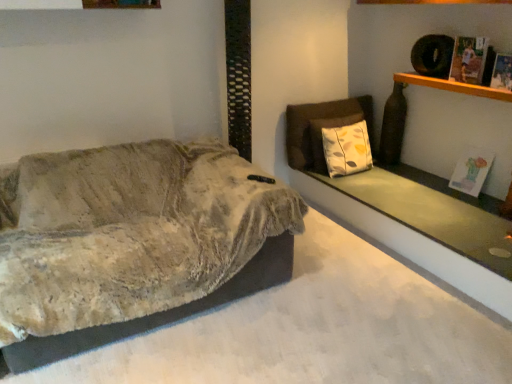
Question: Does textured beige blanket at left have a smaller size compared to printed paper magazine at upper right, which ranks as the 1th magazine in top-to-bottom order?

Choices:
 (A) yes
 (B) no

Answer: (B)

Question: Is textured beige blanket at left turned away from printed paper magazine at upper right, placed as the 3th magazine when sorted from bottom to top?

Choices:
 (A) no
 (B) yes

Answer: (A)

Question: From the image's perspective, is textured beige blanket at left on top of printed paper magazine at upper right, which ranks as the 1th magazine in top-to-bottom order?

Choices:
 (A) yes
 (B) no

Answer: (B)

Question: From a real-world perspective, is textured beige blanket at left beneath printed paper magazine at upper right, arranged as the second magazine when viewed from the back?

Choices:
 (A) yes
 (B) no

Answer: (A)

Question: Is textured beige blanket at left wider than printed paper magazine at upper right, arranged as the 2th magazine when viewed from the front?

Choices:
 (A) no
 (B) yes

Answer: (B)

Question: Considering the relative sizes of textured beige blanket at left and printed paper magazine at upper right, arranged as the second magazine when viewed from the back, in the image provided, is textured beige blanket at left thinner than printed paper magazine at upper right, arranged as the second magazine when viewed from the back,?

Choices:
 (A) no
 (B) yes

Answer: (A)

Question: Does textured beige blanket at left lie behind smooth concrete ledge at upper right?

Choices:
 (A) no
 (B) yes

Answer: (A)

Question: Considering the relative sizes of textured beige blanket at left and smooth concrete ledge at upper right in the image provided, is textured beige blanket at left taller than smooth concrete ledge at upper right?

Choices:
 (A) no
 (B) yes

Answer: (B)

Question: Considering the relative sizes of textured beige blanket at left and smooth concrete ledge at upper right in the image provided, is textured beige blanket at left bigger than smooth concrete ledge at upper right?

Choices:
 (A) yes
 (B) no

Answer: (A)

Question: Considering the relative sizes of textured beige blanket at left and smooth concrete ledge at upper right in the image provided, is textured beige blanket at left shorter than smooth concrete ledge at upper right?

Choices:
 (A) yes
 (B) no

Answer: (B)

Question: Does textured beige blanket at left lie in front of smooth concrete ledge at upper right?

Choices:
 (A) no
 (B) yes

Answer: (B)

Question: From the image's perspective, does textured beige blanket at left appear higher than smooth concrete ledge at upper right?

Choices:
 (A) yes
 (B) no

Answer: (B)

Question: From a real-world perspective, does printed paper magazine at upper right, placed as the 3th magazine when sorted from bottom to top, stand above wooden shelf at upper right?

Choices:
 (A) no
 (B) yes

Answer: (B)